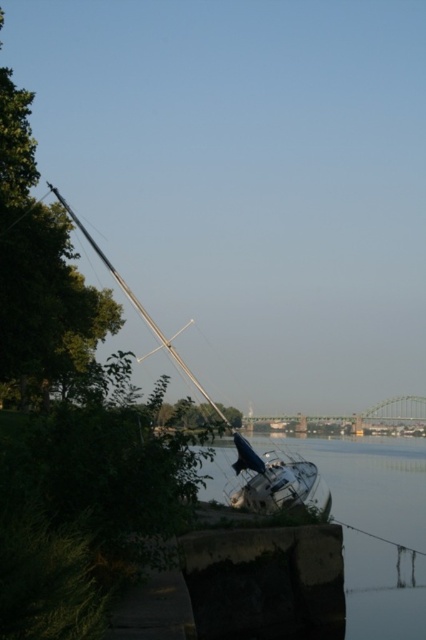
You are standing on the dock and see the white glossy boat at center and the metallic silver mast at left. Which object is positioned to the right of the other?

The white glossy boat at center is positioned to the right of the metallic silver mast at left.

You are standing at the edge of the river and see two points in the image. The first point is at coordinates point (371, 454) and the second is at point (66, 202). Which point is closer to your current position?

Point (66, 202) is closer to your current position because it is closer to the camera than point (371, 454).

You are standing on the dock and want to retrieve an item that fell into the water. You notice the smooth concrete wall at lower center and the metallic silver mast at left. Which object is nearer to you as you stand on the dock?

The smooth concrete wall at lower center is closer to the viewer than the metallic silver mast at left, so the smooth concrete wall at lower center is nearer to you.